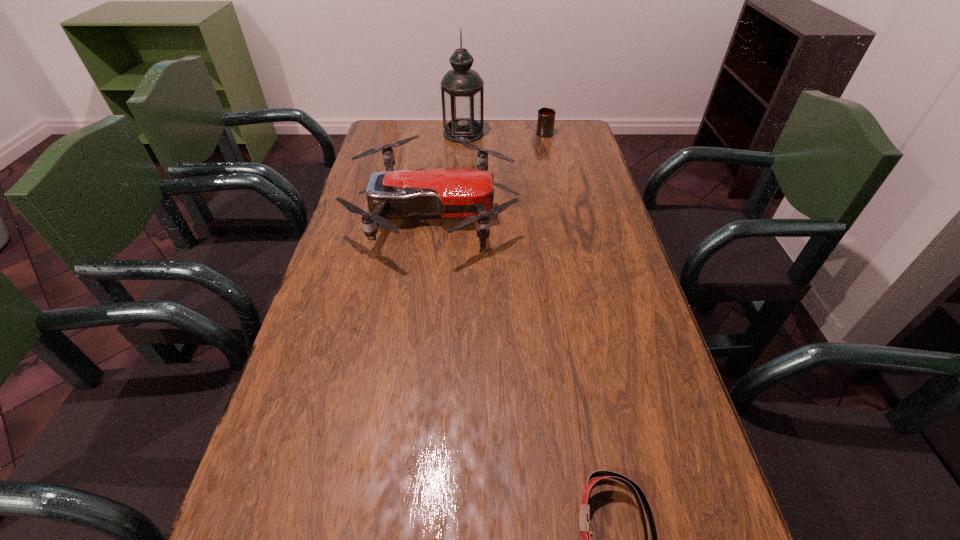
This screenshot has width=960, height=540. Find the location of `oil lamp`. oil lamp is located at coordinates (462, 91).

Locate an element on the screen. This screenshot has height=540, width=960. the second nearest object is located at coordinates (x=465, y=193).

In order to click on can in this screenshot , I will do `click(546, 116)`.

Identify the location of free region located 0.140m on the front of the oil lamp. pos(462,165).

Locate an element on the screen. blank space located on the front-facing side of the second nearest object is located at coordinates (539, 213).

You are a GUI agent. You are given a task and a screenshot of the screen. Output one action in this format:
    pyautogui.click(x=<x>, y=<y>)
    Task: Click on the vacant space located on the front of the can
    This screenshot has width=960, height=540.
    Given the screenshot: What is the action you would take?
    pyautogui.click(x=558, y=195)

Locate an element on the screen. oil lamp located at the far edge is located at coordinates tap(462, 91).

Find the location of a particular element. The width and height of the screenshot is (960, 540). can at the far edge is located at coordinates (546, 116).

What are the coordinates of `object that is at the left edge` in the screenshot? It's located at (465, 193).

I want to click on object present at the right edge, so click(546, 116).